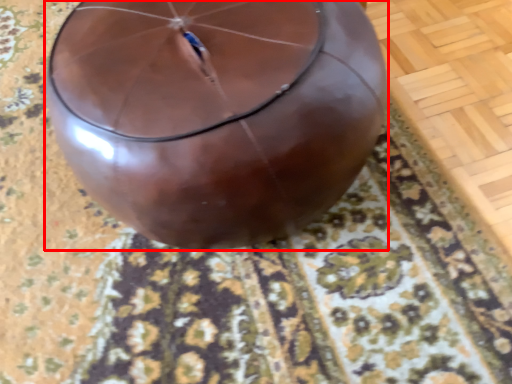
Question: Considering the relative positions of balloon (annotated by the red box) and mat in the image provided, where is balloon (annotated by the red box) located with respect to the staircase?

Choices:
 (A) right
 (B) left

Answer: (A)